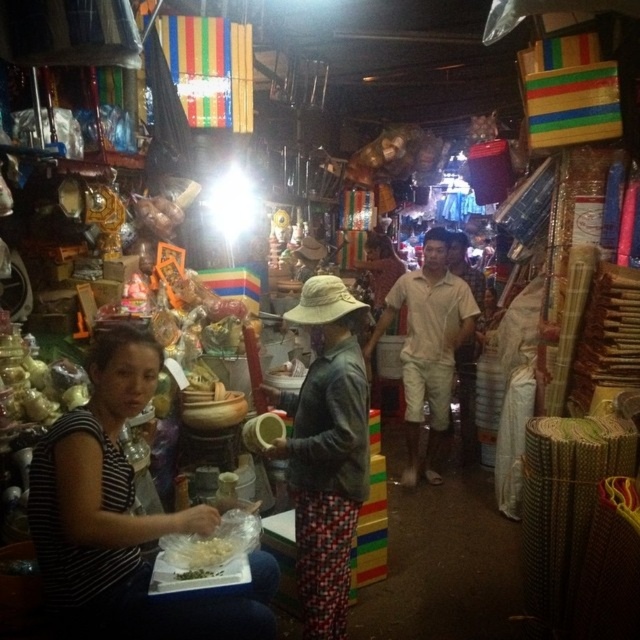
Who is positioned more to the right, striped fabric shirt at lower left or leather jacket at center?

From the viewer's perspective, leather jacket at center appears more on the right side.

Measure the distance between striped fabric shirt at lower left and camera.

They are 1.69 meters apart.

You are a GUI agent. You are given a task and a screenshot of the screen. Output one action in this format:
    pyautogui.click(x=<x>, y=<y>)
    Task: Click on the striped fabric shirt at lower left
    The width and height of the screenshot is (640, 640).
    Given the screenshot: What is the action you would take?
    pyautogui.click(x=122, y=518)

Who is taller, striped fabric shirt at lower left or white matte food at lower left?

With more height is striped fabric shirt at lower left.

Is point (212, 522) behind point (182, 547)?

No, it is in front of (182, 547).

The height and width of the screenshot is (640, 640). Identify the location of striped fabric shirt at lower left. pos(122,518).

Is point (108, 438) closer to camera compared to point (369, 344)?

Yes, point (108, 438) is in front of point (369, 344).

Who is taller, striped fabric shirt at lower left or light brown cotton shirt at center?

Standing taller between the two is light brown cotton shirt at center.

Locate an element on the screen. This screenshot has width=640, height=640. striped fabric shirt at lower left is located at coordinates (122, 518).